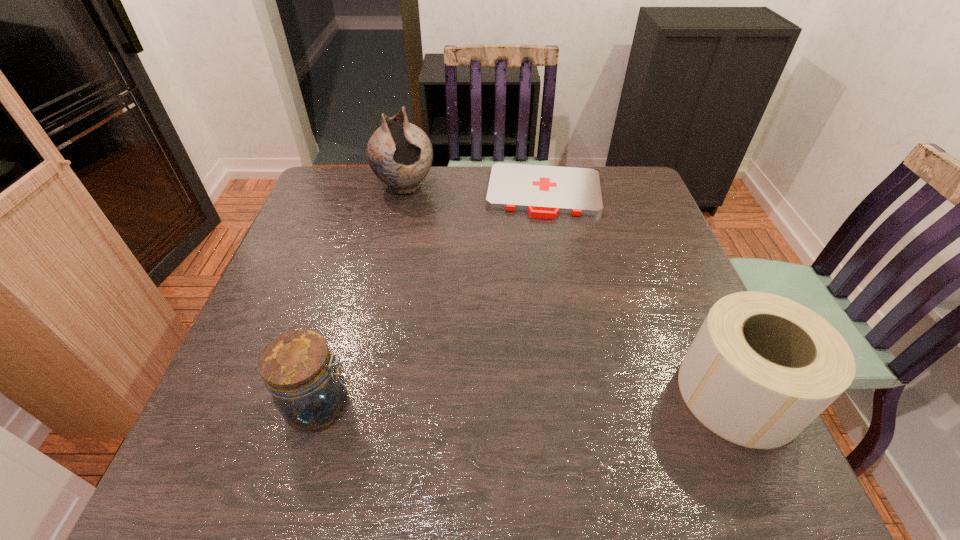
This screenshot has height=540, width=960. In order to click on object that is at the near left corner in this screenshot , I will do `click(298, 369)`.

Where is `object at the far right corner`? The height and width of the screenshot is (540, 960). object at the far right corner is located at coordinates (544, 191).

Locate an element on the screen. object at the near right corner is located at coordinates (762, 367).

Find the location of a particular element. The image size is (960, 540). vacant area at the far edge of the desktop is located at coordinates (431, 205).

Where is `vacant area at the near edge of the desktop`? The image size is (960, 540). vacant area at the near edge of the desktop is located at coordinates (457, 396).

Identify the location of blank space at the left edge of the desktop. The height and width of the screenshot is (540, 960). (303, 280).

This screenshot has width=960, height=540. I want to click on free location at the far left corner of the desktop, so click(320, 185).

At what (x,y) coordinates should I click in order to perform the action: click on vacant region at the far right corner. Please return your answer as a coordinate pair (x, y). This screenshot has height=540, width=960. Looking at the image, I should click on (627, 174).

The height and width of the screenshot is (540, 960). I want to click on unoccupied area between the rightmost object and the second object from right to left, so click(x=641, y=293).

Locate an element on the screen. This screenshot has width=960, height=540. free spot between the jar and the shortest object is located at coordinates (433, 299).